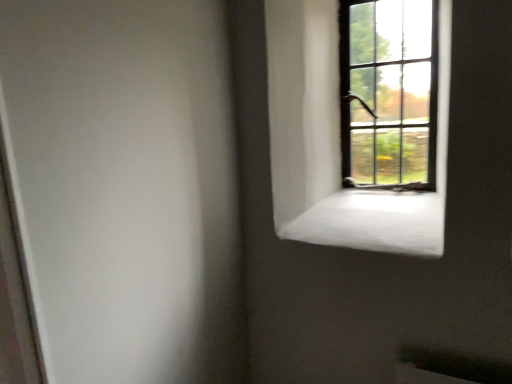
Question: Can you confirm if dark brown wooden window at upper right is wider than white concrete window sill at upper right?

Choices:
 (A) no
 (B) yes

Answer: (A)

Question: Would you say dark brown wooden window at upper right is outside white concrete window sill at upper right?

Choices:
 (A) yes
 (B) no

Answer: (A)

Question: Can you confirm if dark brown wooden window at upper right is taller than white concrete window sill at upper right?

Choices:
 (A) no
 (B) yes

Answer: (B)

Question: Could white concrete window sill at upper right be considered to be inside dark brown wooden window at upper right?

Choices:
 (A) no
 (B) yes

Answer: (A)

Question: Is dark brown wooden window at upper right positioned behind white concrete window sill at upper right?

Choices:
 (A) no
 (B) yes

Answer: (B)

Question: Considering the relative sizes of dark brown wooden window at upper right and white concrete window sill at upper right in the image provided, is dark brown wooden window at upper right shorter than white concrete window sill at upper right?

Choices:
 (A) yes
 (B) no

Answer: (B)

Question: Does white concrete window sill at upper right have a larger size compared to dark brown wooden window at upper right?

Choices:
 (A) no
 (B) yes

Answer: (B)

Question: Is white concrete window sill at upper right thinner than dark brown wooden window at upper right?

Choices:
 (A) yes
 (B) no

Answer: (B)

Question: Is white concrete window sill at upper right positioned with its back to dark brown wooden window at upper right?

Choices:
 (A) yes
 (B) no

Answer: (B)

Question: Is white concrete window sill at upper right shorter than dark brown wooden window at upper right?

Choices:
 (A) yes
 (B) no

Answer: (A)

Question: From a real-world perspective, does white concrete window sill at upper right sit lower than dark brown wooden window at upper right?

Choices:
 (A) yes
 (B) no

Answer: (A)

Question: Is white concrete window sill at upper right wider than dark brown wooden window at upper right?

Choices:
 (A) yes
 (B) no

Answer: (A)

Question: Relative to white concrete window sill at upper right, is dark brown wooden window at upper right in front or behind?

Choices:
 (A) front
 (B) behind

Answer: (B)